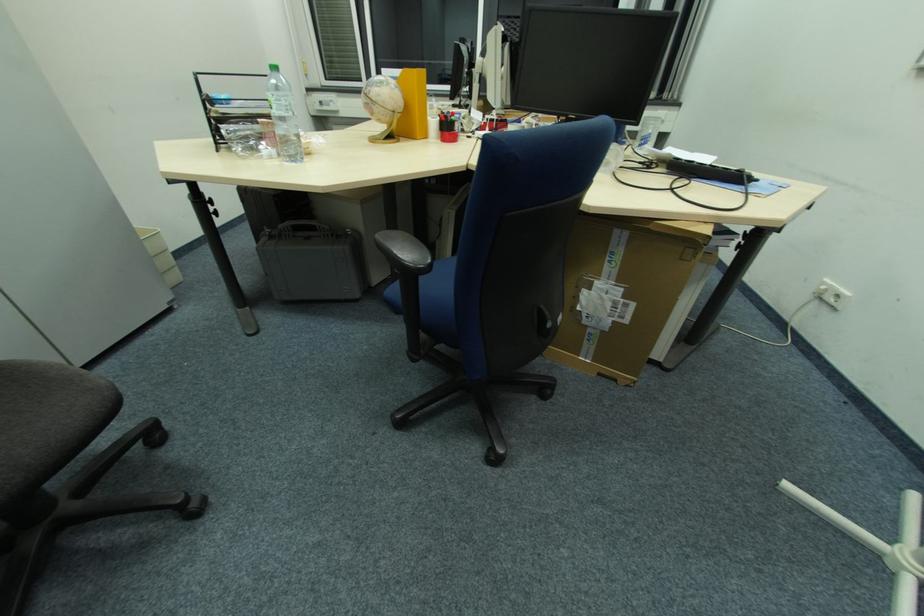
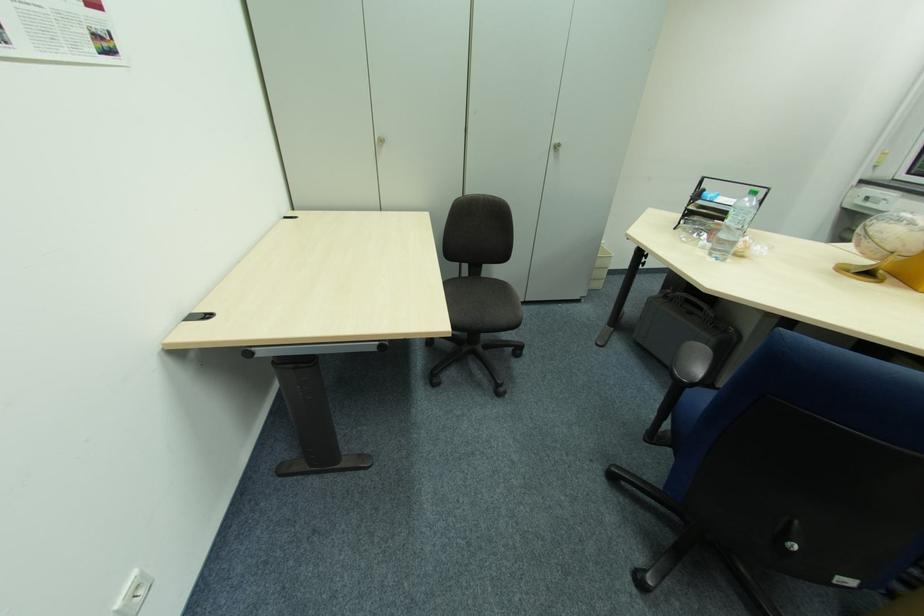
The point at [393,108] is marked in the first image. Where is the corresponding point in the second image?

(893, 249)